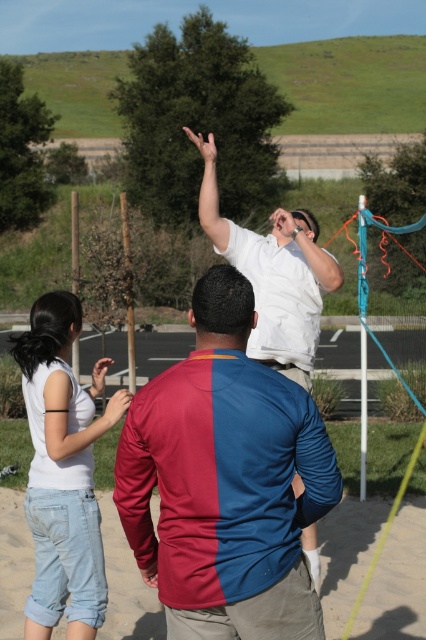
Is brown sandy ground at lower center to the right of white matte shirt at upper center from the viewer's perspective?

Indeed, brown sandy ground at lower center is positioned on the right side of white matte shirt at upper center.

Can you confirm if brown sandy ground at lower center is positioned to the left of white matte shirt at upper center?

In fact, brown sandy ground at lower center is to the right of white matte shirt at upper center.

Image resolution: width=426 pixels, height=640 pixels. I want to click on brown sandy ground at lower center, so click(397, 580).

The width and height of the screenshot is (426, 640). In order to click on brown sandy ground at lower center in this screenshot , I will do `click(397, 580)`.

Locate an element on the screen. Image resolution: width=426 pixels, height=640 pixels. maroon and blue jersey at center is located at coordinates (226, 481).

Can you confirm if maroon and blue jersey at center is wider than light blue denim shorts at lower left?

Indeed, maroon and blue jersey at center has a greater width compared to light blue denim shorts at lower left.

Locate an element on the screen. maroon and blue jersey at center is located at coordinates (226, 481).

You are a GUI agent. You are given a task and a screenshot of the screen. Output one action in this format:
    pyautogui.click(x=<x>, y=<y>)
    Task: Click on the maroon and blue jersey at center
    This screenshot has height=640, width=426.
    Given the screenshot: What is the action you would take?
    pyautogui.click(x=226, y=481)

Between light blue denim shorts at lower left and white matte shirt at upper center, which one appears on the left side from the viewer's perspective?

Positioned to the left is light blue denim shorts at lower left.

Is light blue denim shorts at lower left to the right of white matte shirt at upper center from the viewer's perspective?

Incorrect, light blue denim shorts at lower left is not on the right side of white matte shirt at upper center.

I want to click on light blue denim shorts at lower left, so click(63, 472).

At what (x,y) coordinates should I click in order to perform the action: click on light blue denim shorts at lower left. Please return your answer as a coordinate pair (x, y). Looking at the image, I should click on (x=63, y=472).